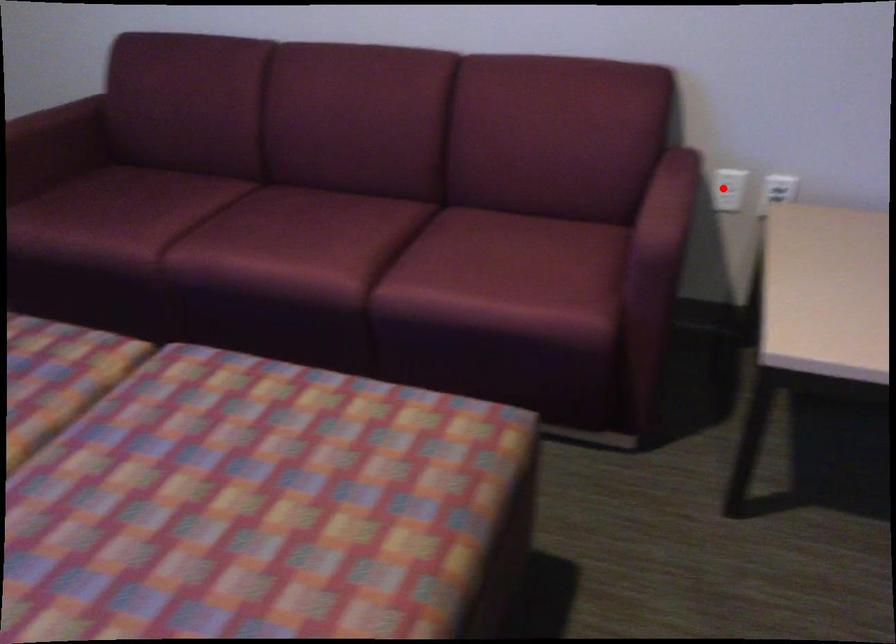
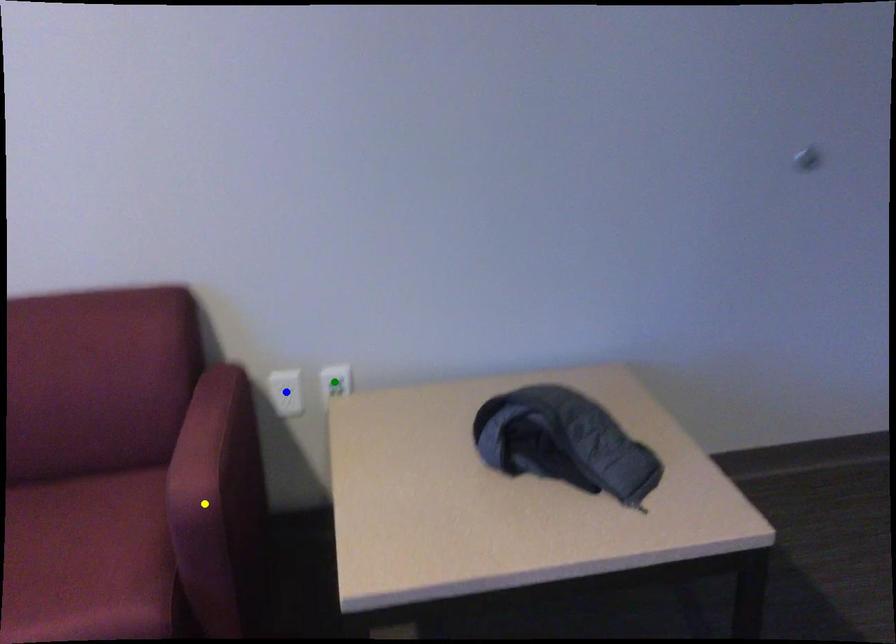
Question: I am providing you with two images of the same scene from different viewpoints. A red point is marked on the first image. You are given multiple points on the second image. Which point in image 2 represents the same 3d spot as the red point in image 1?

Choices:
 (A) green point
 (B) yellow point
 (C) blue point

Answer: (C)